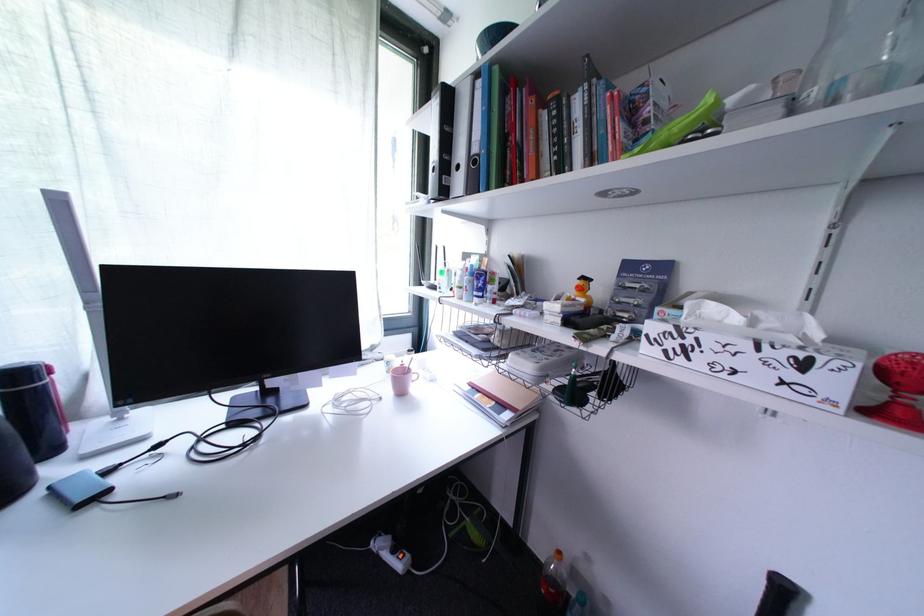
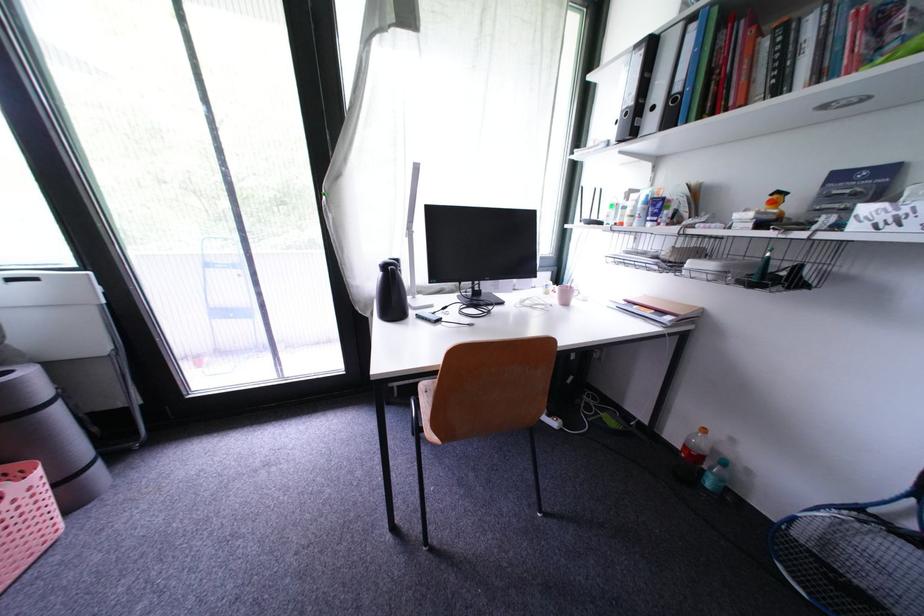
In the second image, find the point that corresponds to point (589, 292) in the first image.

(782, 206)